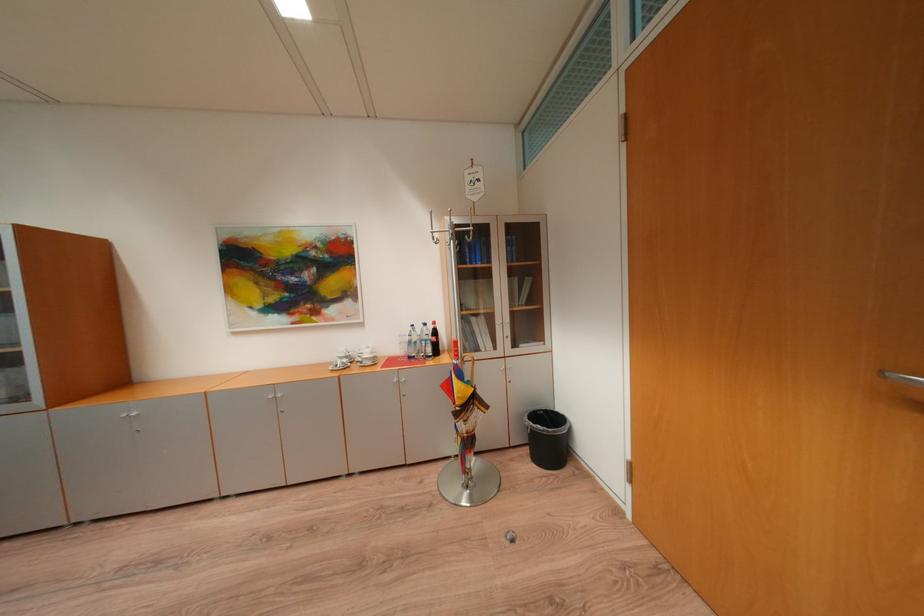
Find where to lift the black trash can. Please return your answer as a coordinate pair (x, y).

(546, 438)